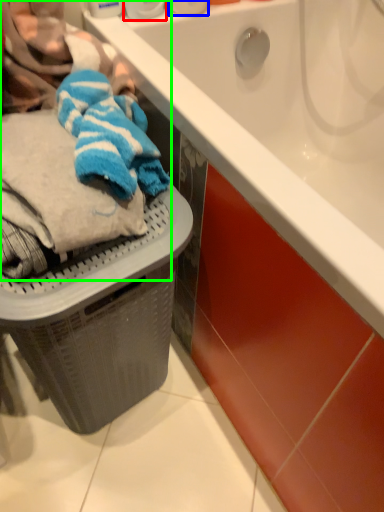
Question: Which object is the farthest from toiletry (highlighted by a red box)? Choose among these: toiletry (highlighted by a blue box) or laundry (highlighted by a green box).

Choices:
 (A) toiletry
 (B) laundry

Answer: (B)